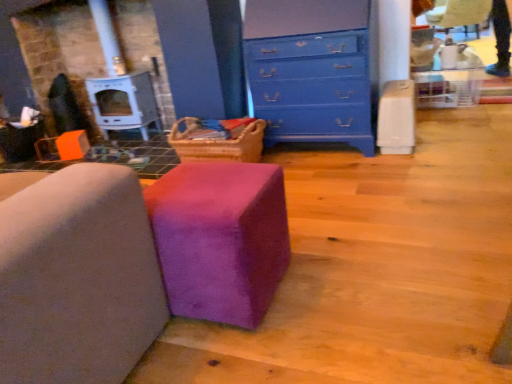
Question: From the image's perspective, does blue painted wood chest of drawers at upper center appear higher than purple suede ottoman at center, placed as the 1th furniture when sorted from left to right?

Choices:
 (A) no
 (B) yes

Answer: (B)

Question: Would you say blue painted wood chest of drawers at upper center contains purple suede ottoman at center, which is the 2th furniture from right to left?

Choices:
 (A) no
 (B) yes

Answer: (A)

Question: Is blue painted wood chest of drawers at upper center facing towards purple suede ottoman at center, placed as the 1th furniture when sorted from left to right?

Choices:
 (A) no
 (B) yes

Answer: (B)

Question: Is blue painted wood chest of drawers at upper center thinner than purple suede ottoman at center, which is the 2th furniture from right to left?

Choices:
 (A) no
 (B) yes

Answer: (B)

Question: Does blue painted wood chest of drawers at upper center have a greater height compared to purple suede ottoman at center, placed as the 1th furniture when sorted from left to right?

Choices:
 (A) yes
 (B) no

Answer: (A)

Question: Can you confirm if blue painted wood chest of drawers at upper center is smaller than purple suede ottoman at center, which is the 2th furniture from right to left?

Choices:
 (A) no
 (B) yes

Answer: (B)

Question: Is purple fuzzy ottoman at center, marked as the second furniture in a left-to-right arrangement, thinner than purple suede ottoman at center, placed as the 1th furniture when sorted from left to right?

Choices:
 (A) no
 (B) yes

Answer: (B)

Question: Are purple fuzzy ottoman at center, marked as the second furniture in a left-to-right arrangement, and purple suede ottoman at center, placed as the 1th furniture when sorted from left to right, far apart?

Choices:
 (A) no
 (B) yes

Answer: (A)

Question: Could purple suede ottoman at center, which is the 2th furniture from right to left, be considered to be inside purple fuzzy ottoman at center, placed as the first furniture when sorted from right to left?

Choices:
 (A) yes
 (B) no

Answer: (B)

Question: Considering the relative positions of purple fuzzy ottoman at center, placed as the first furniture when sorted from right to left, and purple suede ottoman at center, placed as the 1th furniture when sorted from left to right, in the image provided, is purple fuzzy ottoman at center, placed as the first furniture when sorted from right to left, to the left of purple suede ottoman at center, placed as the 1th furniture when sorted from left to right, from the viewer's perspective?

Choices:
 (A) yes
 (B) no

Answer: (B)

Question: From a real-world perspective, is purple fuzzy ottoman at center, placed as the first furniture when sorted from right to left, physically above purple suede ottoman at center, placed as the 1th furniture when sorted from left to right?

Choices:
 (A) no
 (B) yes

Answer: (A)

Question: Is purple fuzzy ottoman at center, placed as the first furniture when sorted from right to left, shorter than purple suede ottoman at center, which is the 2th furniture from right to left?

Choices:
 (A) yes
 (B) no

Answer: (A)

Question: Can you confirm if purple suede ottoman at center, placed as the 1th furniture when sorted from left to right, is bigger than blue painted wood chest of drawers at upper center?

Choices:
 (A) no
 (B) yes

Answer: (B)